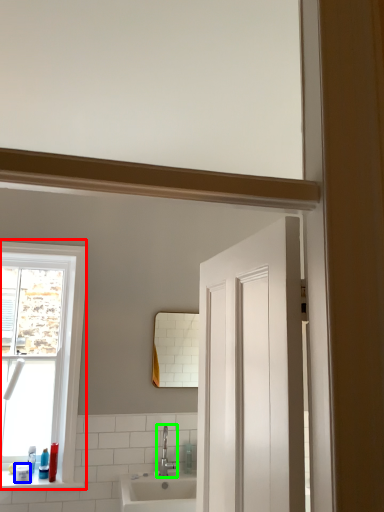
Question: Which is nearer to the window (highlighted by a red box)? toiletry (highlighted by a blue box) or tap (highlighted by a green box).

Choices:
 (A) toiletry
 (B) tap

Answer: (A)